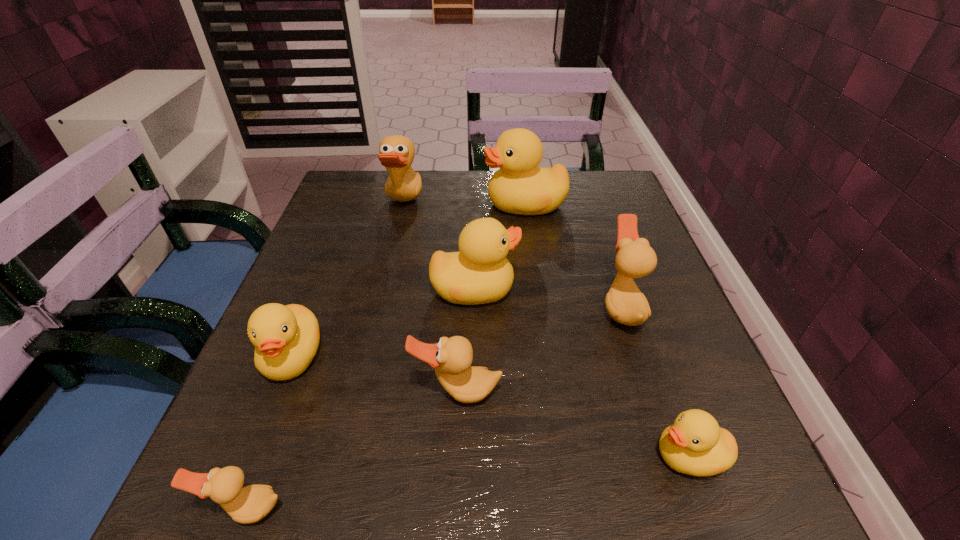
The height and width of the screenshot is (540, 960). I want to click on the nearest yellow duck, so click(695, 445).

Where is `the rightmost yellow duck`? The width and height of the screenshot is (960, 540). the rightmost yellow duck is located at coordinates (695, 445).

I want to click on the smallest tan duck, so click(250, 504).

You are a GUI agent. You are given a task and a screenshot of the screen. Output one action in this format:
    pyautogui.click(x=<x>, y=<y>)
    Task: Click on the leftmost tan duck
    The height and width of the screenshot is (540, 960).
    Given the screenshot: What is the action you would take?
    pyautogui.click(x=250, y=504)

What are the coordinates of `free spot located at the beak of the farthest yellow duck` in the screenshot? It's located at (372, 204).

In order to click on free spot located 0.280m at the beak of the farthest yellow duck in this screenshot , I will do `click(375, 204)`.

What are the coordinates of `vacant space located at the beak of the farthest yellow duck` in the screenshot? It's located at (452, 204).

Locate an element on the screen. free space located on the beak of the biggest tan duck is located at coordinates (468, 204).

This screenshot has height=540, width=960. Identify the location of free region located at the beak of the third smallest yellow duck. (552, 289).

At what (x,y) coordinates should I click in order to perform the action: click on free space located on the beak of the third smallest tan duck. Please return your answer as a coordinate pair (x, y). Looking at the image, I should click on (565, 307).